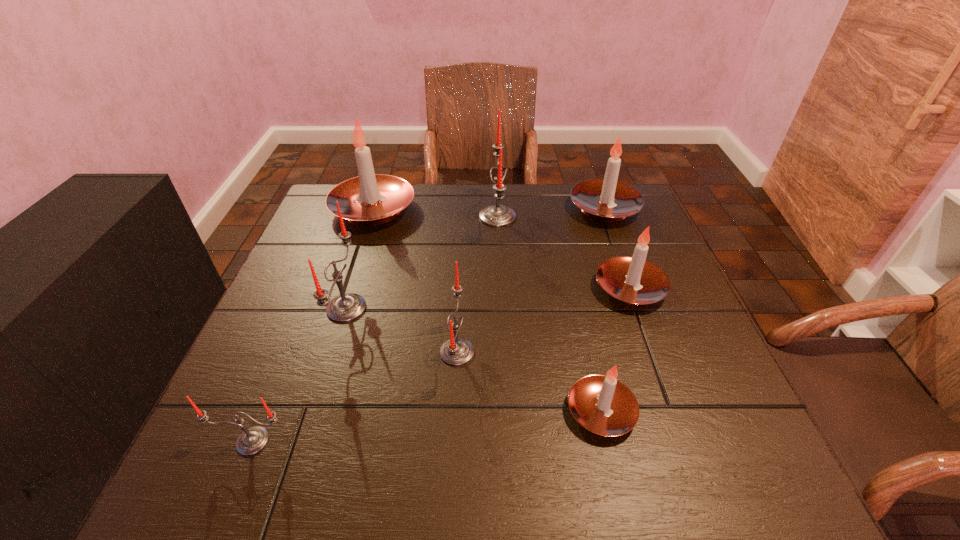
Where is `vacant area situated 0.330m on the front of the leftmost white candle`? The image size is (960, 540). vacant area situated 0.330m on the front of the leftmost white candle is located at coordinates (335, 326).

Locate an element on the screen. Image resolution: width=960 pixels, height=540 pixels. blank area located 0.250m on the front-facing side of the rightmost red candle is located at coordinates (392, 217).

The image size is (960, 540). I want to click on blank space located 0.280m on the front-facing side of the rightmost red candle, so click(381, 217).

At what (x,y) coordinates should I click in order to perform the action: click on vacant space located 0.260m on the front-facing side of the rightmost red candle. Please return your answer as a coordinate pair (x, y). The height and width of the screenshot is (540, 960). Looking at the image, I should click on (388, 217).

Find the location of a particular element. The image size is (960, 540). free space located 0.170m on the front of the third smallest white candle is located at coordinates (628, 270).

Find the location of `free space located on the front-facing side of the third smallest red candle`. free space located on the front-facing side of the third smallest red candle is located at coordinates (535, 308).

At what (x,y) coordinates should I click in order to perform the action: click on vacant region located on the left of the third biggest white candle. Please return your answer as a coordinate pair (x, y). This screenshot has height=540, width=960. Looking at the image, I should click on (463, 288).

This screenshot has height=540, width=960. Identify the location of vacant area located 0.120m on the front-facing side of the fourth candle from left to right. (533, 352).

Find the location of a particular element. Image resolution: width=960 pixels, height=540 pixels. free point located on the left of the nearest white candle is located at coordinates point(418,411).

Locate an element on the screen. object present at the far left corner is located at coordinates (370, 199).